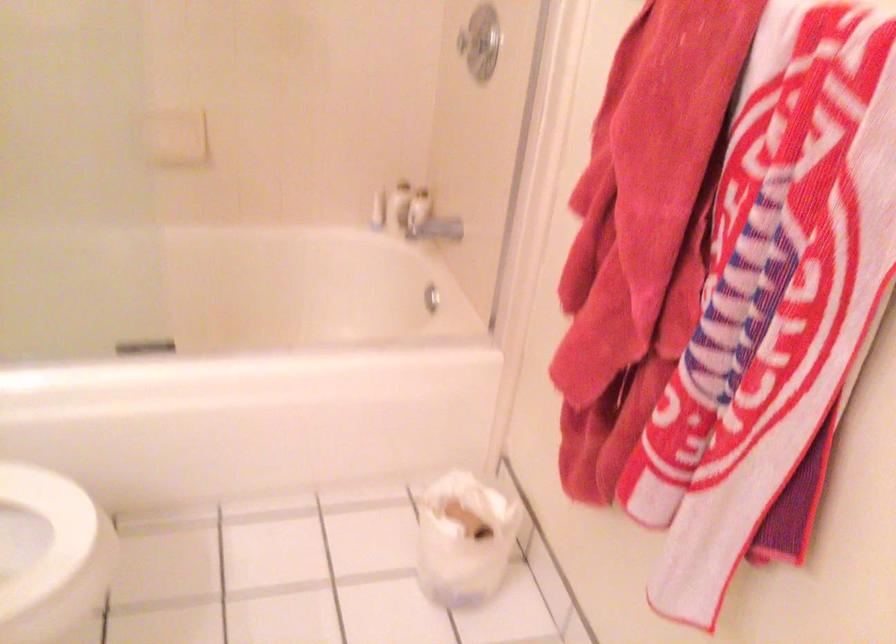
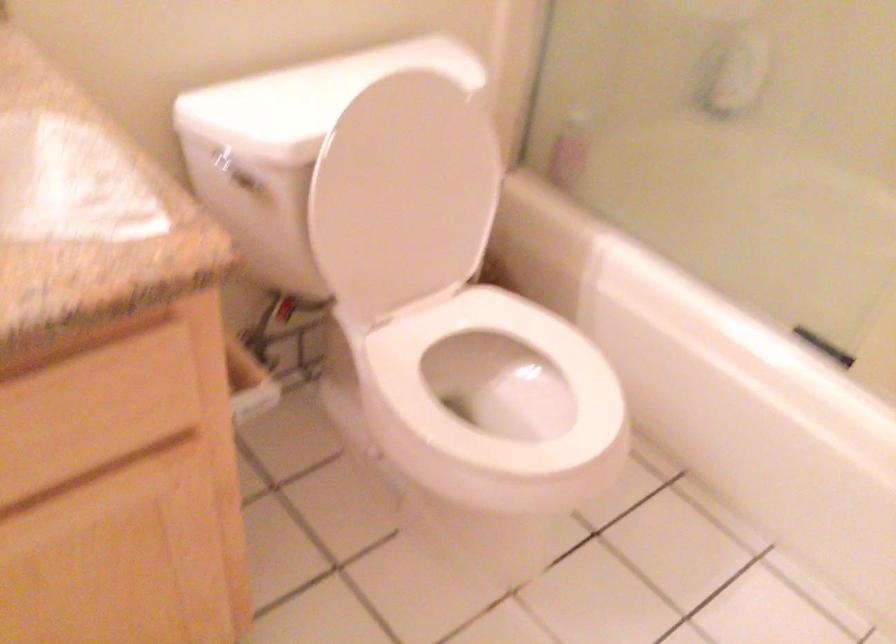
First-person continuous shooting, in which direction is the camera rotating?

The rotation direction of the camera is left-down.